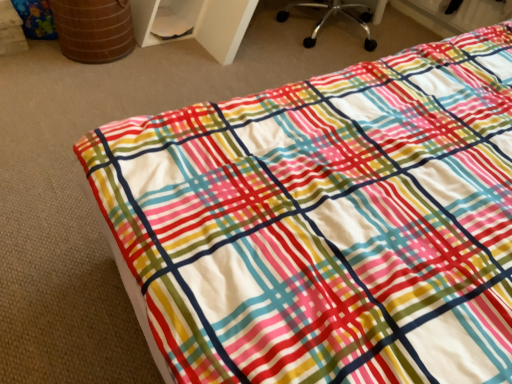
Where is `free spot below metallic silver chair at upper center (from a real-world perspective)`? Image resolution: width=512 pixels, height=384 pixels. free spot below metallic silver chair at upper center (from a real-world perspective) is located at coordinates (329, 31).